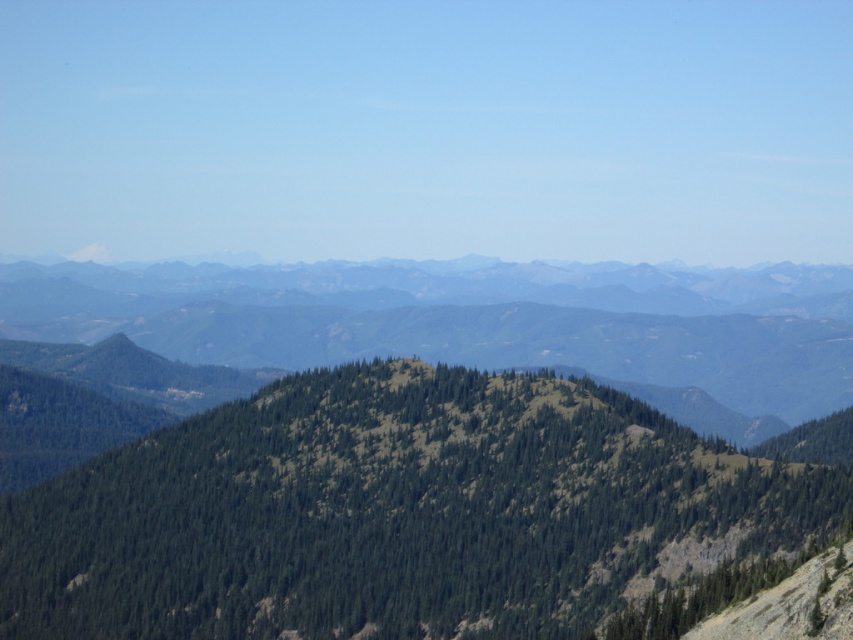
Looking at this image, which is below, green textured mountain at center or green textured mountain range at center?

green textured mountain at center is below.

Consider the image. Can you confirm if green textured mountain at center is bigger than green textured mountain range at center?

Incorrect, green textured mountain at center is not larger than green textured mountain range at center.

Image resolution: width=853 pixels, height=640 pixels. I want to click on green textured mountain at center, so click(x=393, y=513).